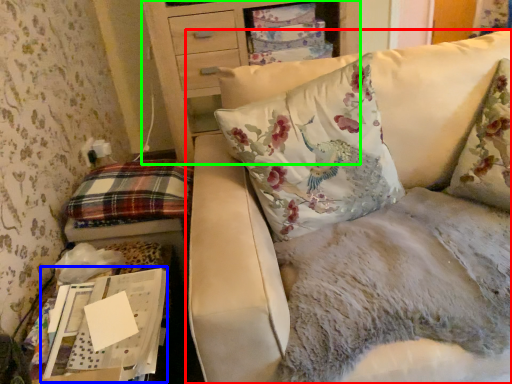
Question: Which object is the closest to the studio couch (highlighted by a red box)? Choose among these: cardboard box (highlighted by a blue box) or furniture (highlighted by a green box).

Choices:
 (A) cardboard box
 (B) furniture

Answer: (A)